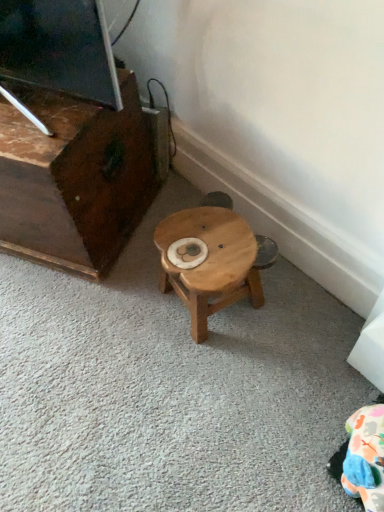
Question: In terms of size, does dark brown wood entertainment center at left appear bigger or smaller than wooden stool at center?

Choices:
 (A) small
 (B) big

Answer: (B)

Question: Is dark brown wood entertainment center at left inside the boundaries of wooden stool at center, or outside?

Choices:
 (A) outside
 (B) inside

Answer: (A)

Question: From the image's perspective, is dark brown wood entertainment center at left located above or below wooden stool at center?

Choices:
 (A) above
 (B) below

Answer: (A)

Question: Is point (210, 270) closer or farther from the camera than point (8, 117)?

Choices:
 (A) farther
 (B) closer

Answer: (B)

Question: Based on their sizes in the image, would you say wooden stool at center is bigger or smaller than dark brown wood entertainment center at left?

Choices:
 (A) small
 (B) big

Answer: (A)

Question: Based on their positions, is wooden stool at center located to the left or right of dark brown wood entertainment center at left?

Choices:
 (A) right
 (B) left

Answer: (A)

Question: Looking at their shapes, would you say wooden stool at center is wider or thinner than dark brown wood entertainment center at left?

Choices:
 (A) wide
 (B) thin

Answer: (B)